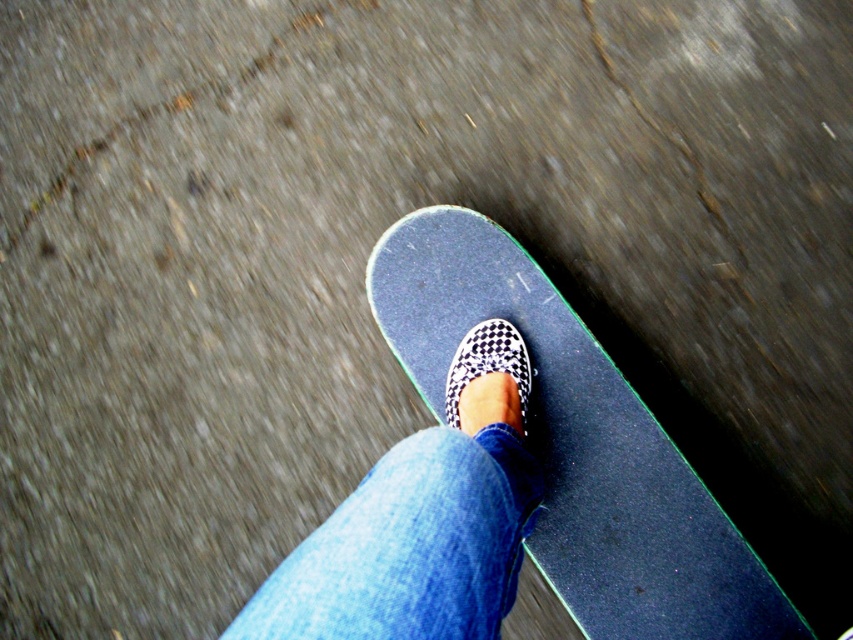
Question: Is smooth black skateboard at center in front of black checkered slip-on shoe at center?

Choices:
 (A) yes
 (B) no

Answer: (A)

Question: Among these objects, which one is farthest from the camera?

Choices:
 (A) matte black skate shoe at center
 (B) black checkered slip-on shoe at center
 (C) smooth black skateboard at center

Answer: (B)

Question: Does matte black skate shoe at center have a smaller size compared to black checkered slip-on shoe at center?

Choices:
 (A) yes
 (B) no

Answer: (B)

Question: Which of the following is the closest to the observer?

Choices:
 (A) black checkered slip-on shoe at center
 (B) smooth black skateboard at center
 (C) matte black skate shoe at center

Answer: (C)

Question: Observing the image, what is the correct spatial positioning of smooth black skateboard at center in reference to black checkered slip-on shoe at center?

Choices:
 (A) right
 (B) left

Answer: (A)

Question: Which object is farther from the camera taking this photo?

Choices:
 (A) black checkered slip-on shoe at center
 (B) matte black skate shoe at center
 (C) smooth black skateboard at center

Answer: (A)